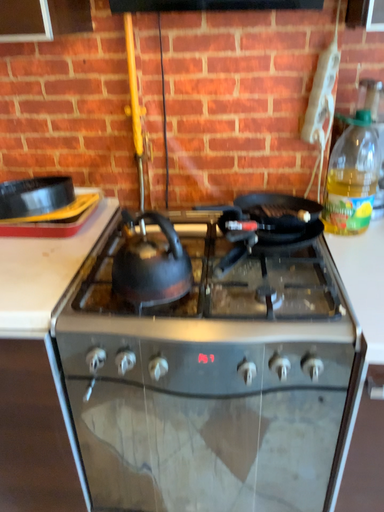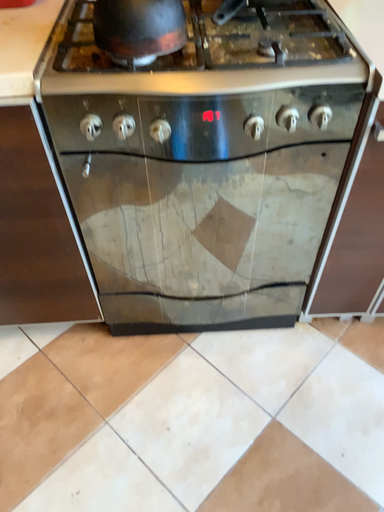
Question: How did the camera likely rotate when shooting the video?

Choices:
 (A) rotated downward
 (B) rotated upward

Answer: (A)